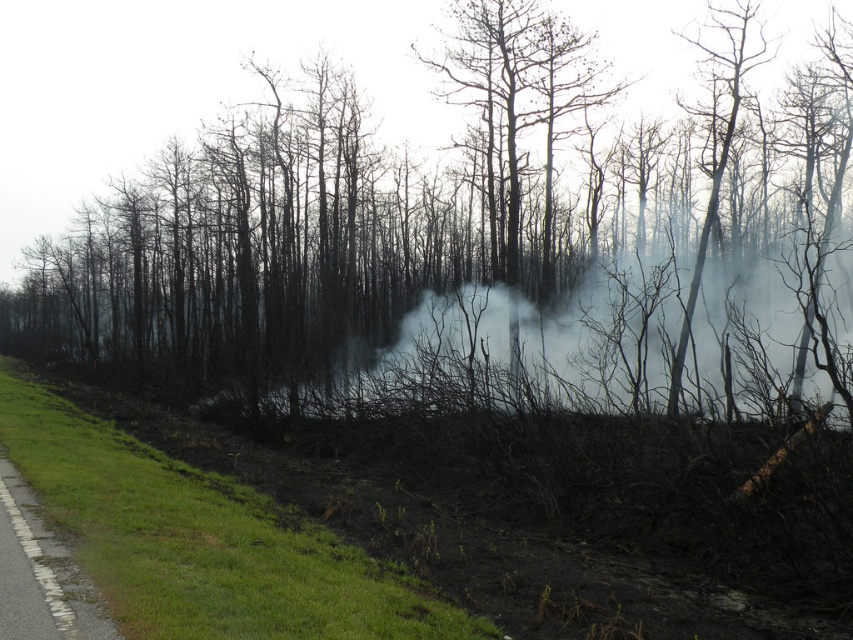
Question: Which point is farther from the camera taking this photo?

Choices:
 (A) (723, 400)
 (B) (534, 28)

Answer: (B)

Question: Can you confirm if charcoal bark tree at center is positioned below white smoke at center?

Choices:
 (A) no
 (B) yes

Answer: (A)

Question: Considering the relative positions of charcoal bark tree at center and white smoke at center in the image provided, where is charcoal bark tree at center located with respect to white smoke at center?

Choices:
 (A) above
 (B) below

Answer: (A)

Question: Is charcoal bark tree at center further to camera compared to white smoke at center?

Choices:
 (A) yes
 (B) no

Answer: (A)